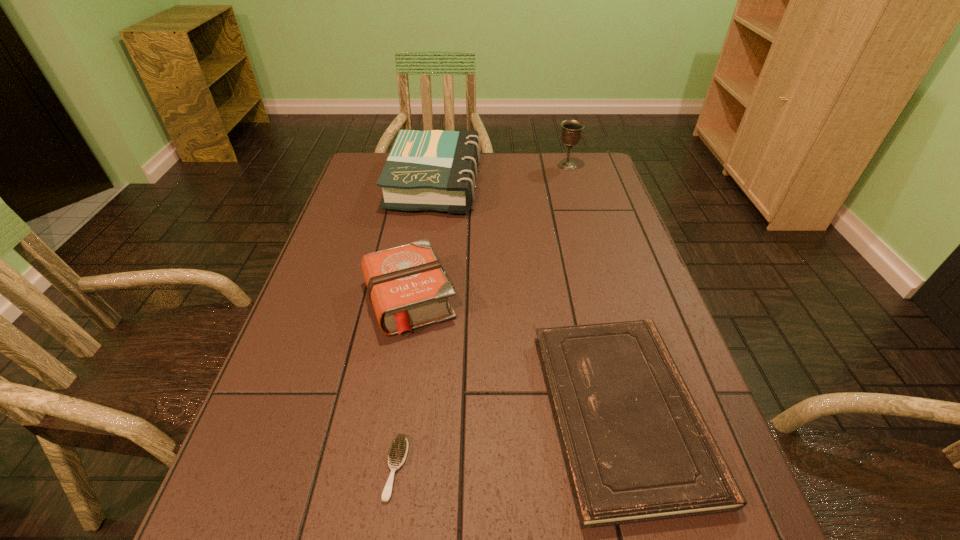
The height and width of the screenshot is (540, 960). I want to click on vacant area located on the back of the shorter paperback book, so click(591, 295).

You are a GUI agent. You are given a task and a screenshot of the screen. Output one action in this format:
    pyautogui.click(x=<x>, y=<y>)
    Task: Click on the vacant space located 0.090m on the back of the scrubbing brush
    
    Given the screenshot: What is the action you would take?
    point(407,394)

Locate an element on the screen. The image size is (960, 540). chalice at the far edge is located at coordinates (571, 133).

Where is `paperback book at the far edge`? paperback book at the far edge is located at coordinates (436, 170).

Where is `paperback book situated at the left edge`? Image resolution: width=960 pixels, height=540 pixels. paperback book situated at the left edge is located at coordinates (436, 170).

This screenshot has width=960, height=540. What are the coordinates of `Bible at the left edge` in the screenshot? It's located at (407, 286).

At what (x,y) coordinates should I click in order to perform the action: click on chalice that is positioned at the right edge. Please return your answer as a coordinate pair (x, y). Looking at the image, I should click on (571, 133).

Where is `paperback book that is at the right edge`? paperback book that is at the right edge is located at coordinates (636, 448).

Find the location of a particular element. This screenshot has width=960, height=540. object that is at the far left corner is located at coordinates (436, 170).

This screenshot has width=960, height=540. Identify the location of object that is at the far right corner. (571, 133).